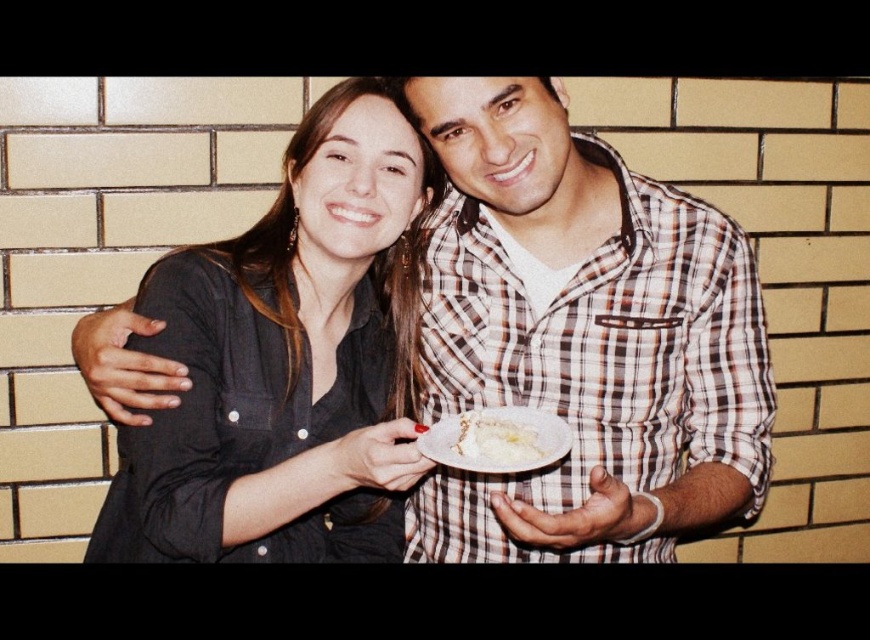
What is the location of the point with coordinates [583,337] in the image?

The point with coordinates [583,337] is on the checkered fabric shirt at center.

You are a photographer trying to capture a clear photo of the checkered fabric shirt at center and the white creamy cake at center. Which object should you focus on first to ensure both are in focus?

The checkered fabric shirt at center is in front of the white creamy cake at center, so you should focus on the checkered fabric shirt at center first to ensure both are in focus.

You are a photographer standing 1 meter away from the camera. You want to take a picture of the checkered fabric shirt at center. Can you move closer to the shirt without moving the camera?

The checkered fabric shirt at center and camera are 82.08 centimeters apart from each other. Since you are currently 1 meter away from the camera, you can move closer to the shirt as long as you stay within the remaining distance between you and the camera.